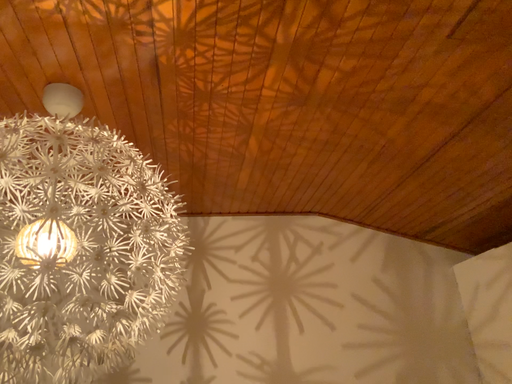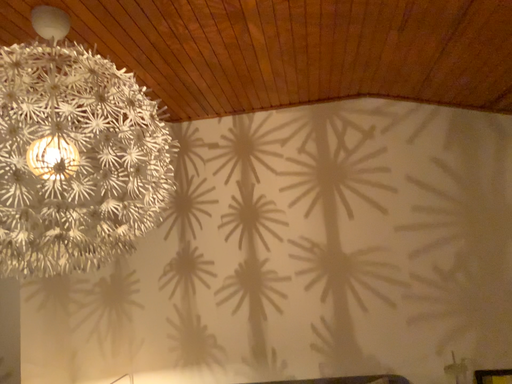
Question: Which way did the camera rotate in the video?

Choices:
 (A) rotated upward
 (B) rotated downward

Answer: (B)